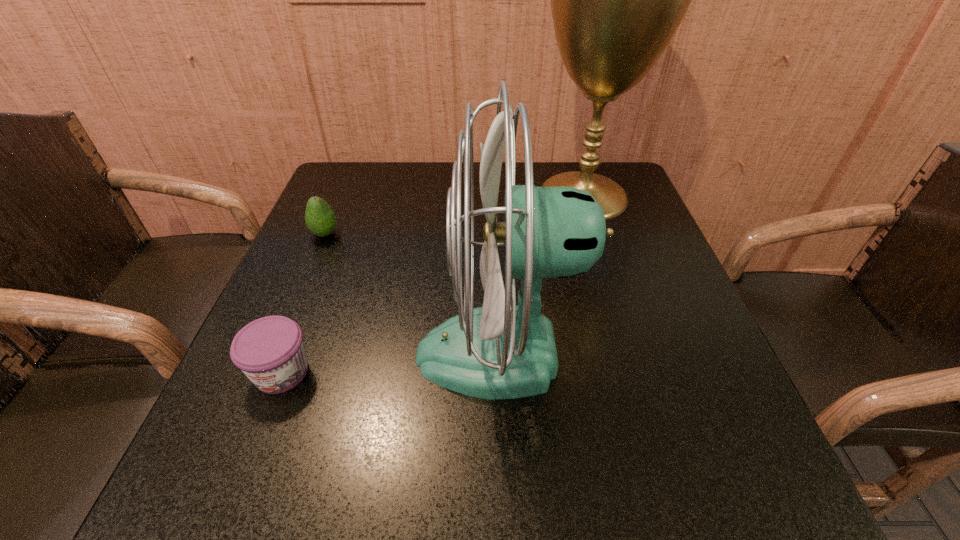
Image resolution: width=960 pixels, height=540 pixels. I want to click on vacant position in the image that satisfies the following two spatial constraints: 1. in front of the second tallest object, directing airflow; 2. on the front label of the jam, so click(x=500, y=372).